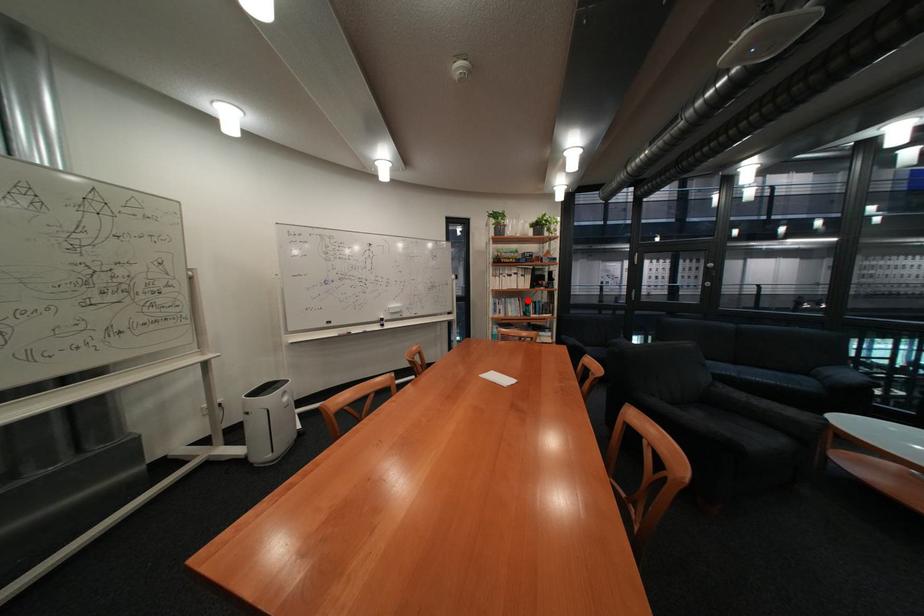
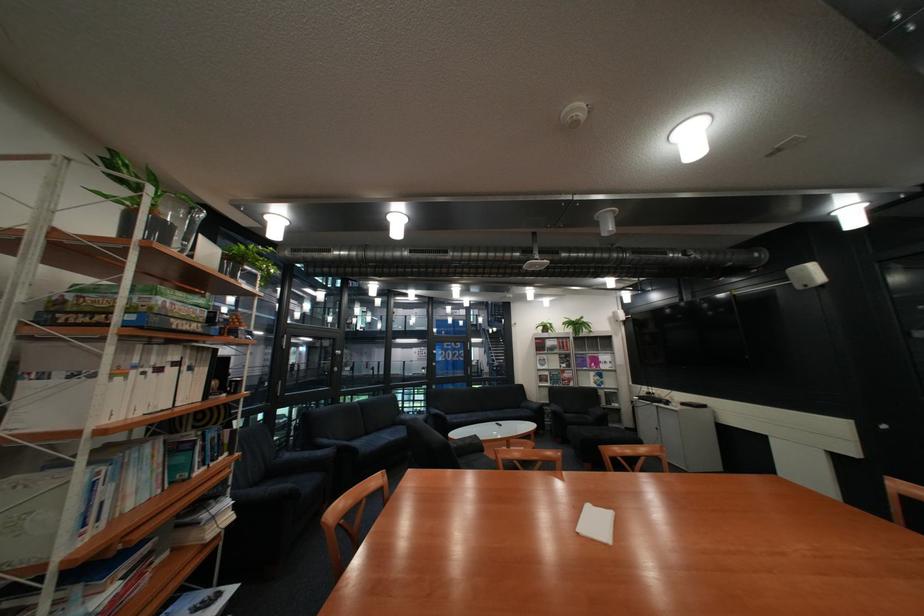
Locate, in the second image, the point that corresponds to the highlighted location in the first image.

(163, 448)